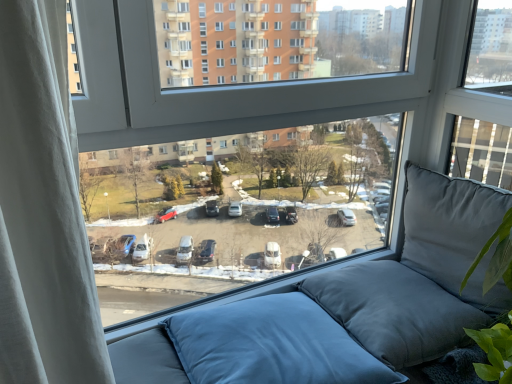
Question: In the image, is transparent glass window at center positioned in front of or behind blue fabric pillow at lower center, the first pillow from the left?

Choices:
 (A) front
 (B) behind

Answer: (A)

Question: Looking at the image, does transparent glass window at center seem bigger or smaller compared to blue fabric pillow at lower center, the first pillow from the left?

Choices:
 (A) big
 (B) small

Answer: (A)

Question: Considering the real-world distances, which object is closest to the transparent glass window at center?

Choices:
 (A) matte gray cushion at right, positioned as the second pillow in left-to-right order
 (B) blue fabric pillow at lower center, which ranks as the 2th pillow in right-to-left order

Answer: (A)

Question: Which object is the closest to the matte gray cushion at right, positioned as the second pillow in left-to-right order?

Choices:
 (A) transparent glass window at center
 (B) blue fabric pillow at lower center, the first pillow from the left

Answer: (A)